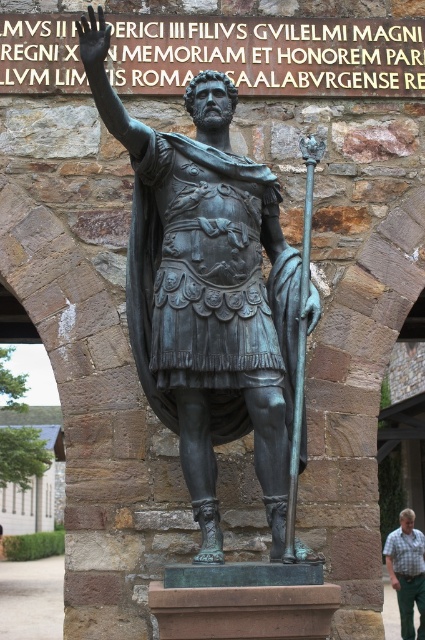
Question: Does bronze statue at center lie behind green plaid shirt at lower right?

Choices:
 (A) yes
 (B) no

Answer: (B)

Question: Which point appears closest to the camera in this image?

Choices:
 (A) coord(231,214)
 (B) coord(402,627)

Answer: (A)

Question: Which object is farther from the camera taking this photo?

Choices:
 (A) green plaid shirt at lower right
 (B) bronze statue at center
 (C) bronze spear at center

Answer: (A)

Question: Is bronze statue at center to the right of green plaid shirt at lower right from the viewer's perspective?

Choices:
 (A) no
 (B) yes

Answer: (A)

Question: Is bronze statue at center to the right of bronze spear at center from the viewer's perspective?

Choices:
 (A) no
 (B) yes

Answer: (A)

Question: Which point is closer to the camera?

Choices:
 (A) (399, 589)
 (B) (210, 280)

Answer: (B)